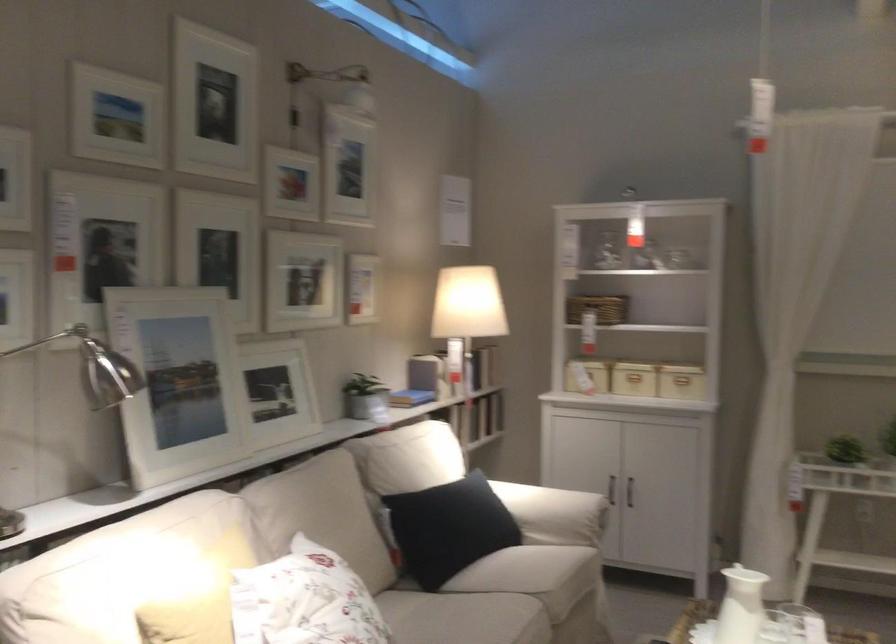
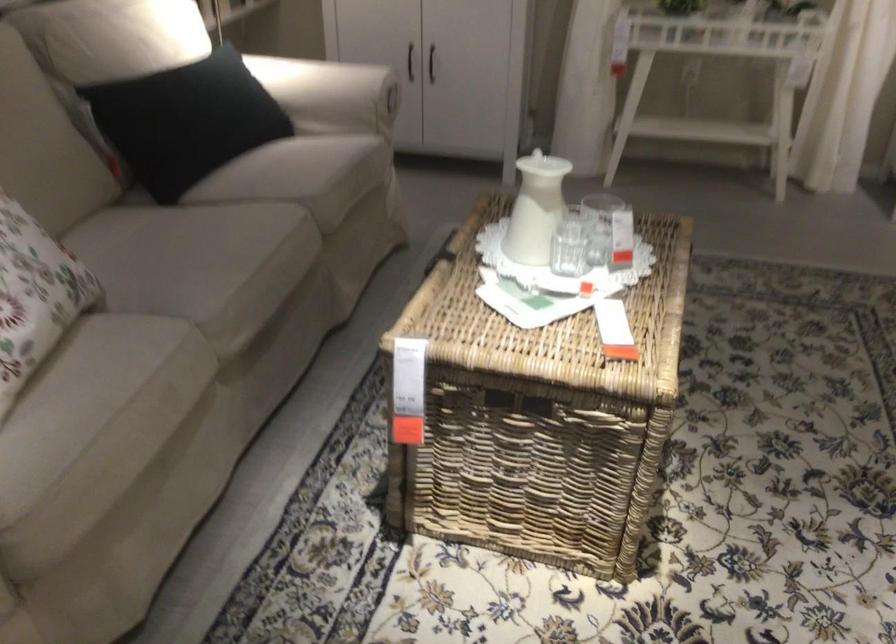
Question: The first image is from the beginning of the video and the second image is from the end. How did the camera likely rotate when shooting the video?

Choices:
 (A) Left
 (B) Right
 (C) Up
 (D) Down

Answer: (D)